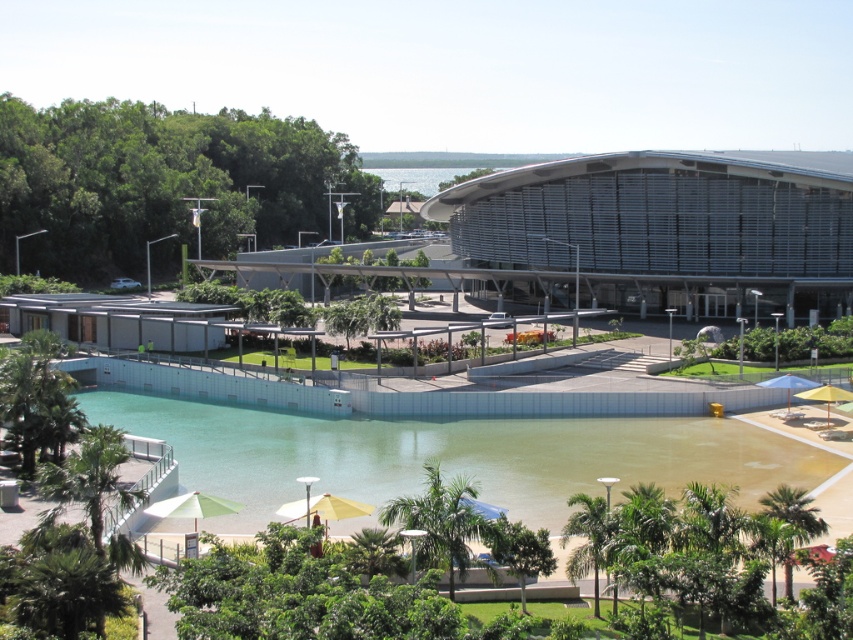
You are planning to take a photo of the metallic silver building at center and the green concrete swimming pool at lower center. Which object should you focus on first if you want to capture both in one frame without moving the camera?

You should focus on the metallic silver building at center first because it is above the green concrete swimming pool at lower center, so it will appear in the frame naturally when capturing the lower object.

You are standing in the modern architectural complex and want to walk from the green leafy tree at upper left to the green leafy palm tree at lower center. Which direction should you move relative to your current position?

You should move downward because the green leafy palm tree at lower center is closer to you than the green leafy tree at upper left, which is further away.